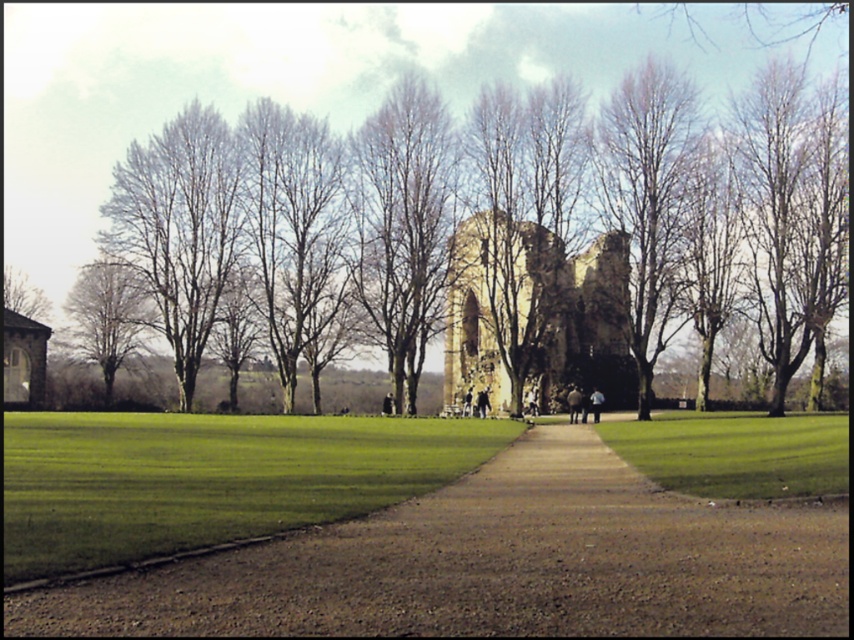
Question: Which is nearer to the smooth bark tree at left?

Choices:
 (A) brown stone ruins at center
 (B) brown leafless tree at left

Answer: (B)

Question: Is dirt/gravel path at center thinner than smooth bark tree at left?

Choices:
 (A) yes
 (B) no

Answer: (A)

Question: Which of the following is the closest to the observer?

Choices:
 (A) (36, 305)
 (B) (488, 294)
 (C) (449, 464)

Answer: (C)

Question: Does dirt/gravel path at center have a larger size compared to brown stone ruins at center?

Choices:
 (A) yes
 (B) no

Answer: (B)

Question: Can you confirm if brown textured tree at center is positioned to the right of brown leafless tree at left?

Choices:
 (A) no
 (B) yes

Answer: (B)

Question: Which point is farther to the camera?

Choices:
 (A) (28, 289)
 (B) (127, 355)
 (C) (578, 428)

Answer: (A)